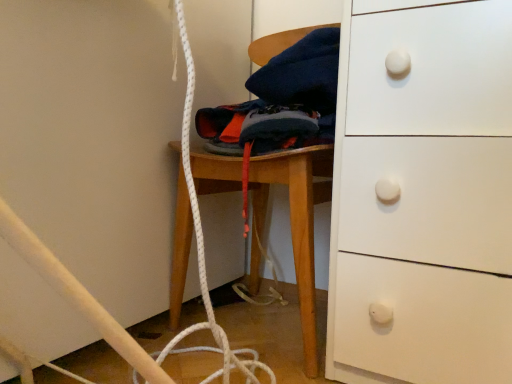
The image size is (512, 384). I want to click on vacant space underneath white textured battle rope at center (from a real-world perspective), so click(x=269, y=324).